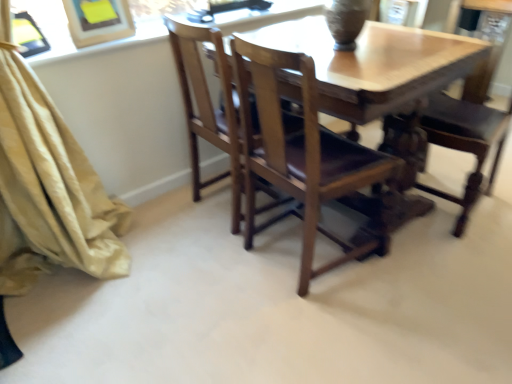
Find the location of a particular element. The height and width of the screenshot is (384, 512). free region under beige fabric curtain at left (from a real-world perspective) is located at coordinates pyautogui.click(x=60, y=269).